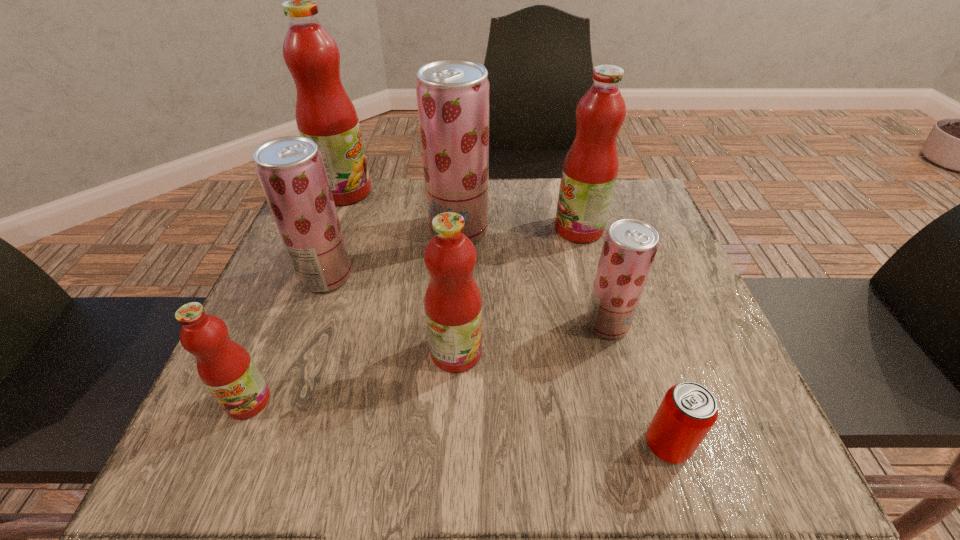
In order to click on the second closest fruit juice to the third nearest pink fruit juice in this screenshot , I will do [x=630, y=245].

Locate an element on the screen. pink fruit juice object that ranks as the fourth closest to the leftmost strawberry fruit juice is located at coordinates (590, 168).

Locate which pink fruit juice ranks in proximity to the nearest object. Please provide its 2D coordinates. Your answer should be formatted as a tuple, i.e. [(x, y)], where the tuple contains the x and y coordinates of a point satisfying the conditions above.

[(453, 303)]

Locate an element on the screen. strawberry fruit juice that is the second closest to the third nearest pink fruit juice is located at coordinates (630, 245).

Locate which strawberry fruit juice is the closest to the farthest strawberry fruit juice. Please provide its 2D coordinates. Your answer should be formatted as a tuple, i.e. [(x, y)], where the tuple contains the x and y coordinates of a point satisfying the conditions above.

[(291, 170)]

Where is `free spot that satisfies the following two spatial constraints: 1. on the front label of the farthest fruit juice; 2. on the left side of the shortest object`? This screenshot has width=960, height=540. free spot that satisfies the following two spatial constraints: 1. on the front label of the farthest fruit juice; 2. on the left side of the shortest object is located at coordinates (245, 446).

Locate an element on the screen. free space that satisfies the following two spatial constraints: 1. on the front label of the second biggest pink fruit juice; 2. on the front label of the smallest pink fruit juice is located at coordinates (624, 401).

What are the coordinates of `free space that satisfies the following two spatial constraints: 1. on the front label of the can; 2. on the right side of the third smallest pink fruit juice` in the screenshot? It's located at (636, 446).